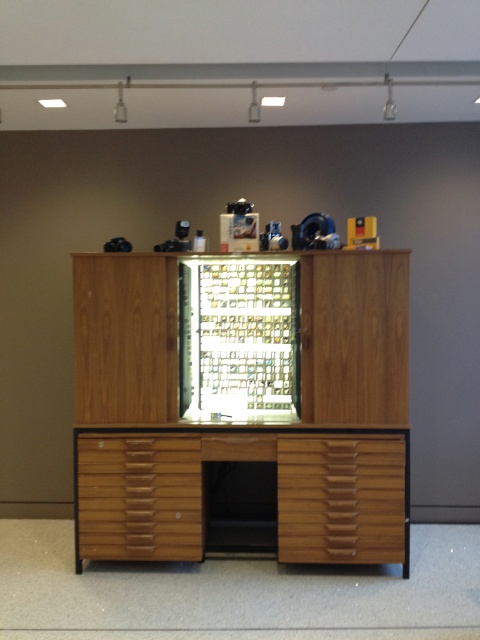
Question: Does wooden file cabinet at center have a larger size compared to wooden drawer at center?

Choices:
 (A) yes
 (B) no

Answer: (A)

Question: Can you confirm if wooden drawer at center is wider than wooden drawer at lower center?

Choices:
 (A) yes
 (B) no

Answer: (A)

Question: Does metallic grid at center have a larger size compared to wooden drawer at center?

Choices:
 (A) yes
 (B) no

Answer: (A)

Question: Among these points, which one is nearest to the camera?

Choices:
 (A) (214, 275)
 (B) (339, 508)
 (C) (136, 276)
 (D) (127, 484)

Answer: (B)

Question: Which of the following is the farthest from the observer?

Choices:
 (A) wooden drawer at center
 (B) wooden drawer at lower center

Answer: (B)

Question: Among these objects, which one is farthest from the camera?

Choices:
 (A) wooden drawer at lower center
 (B) wooden drawer at center
 (C) wooden file cabinet at center

Answer: (A)